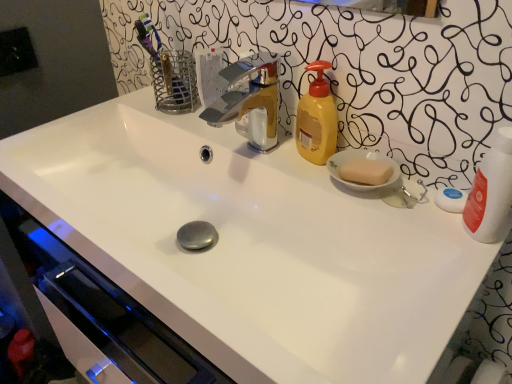
The height and width of the screenshot is (384, 512). What are the coordinates of `vacant space to the left of yellow matte soap dispenser at upper right` in the screenshot? It's located at (242, 141).